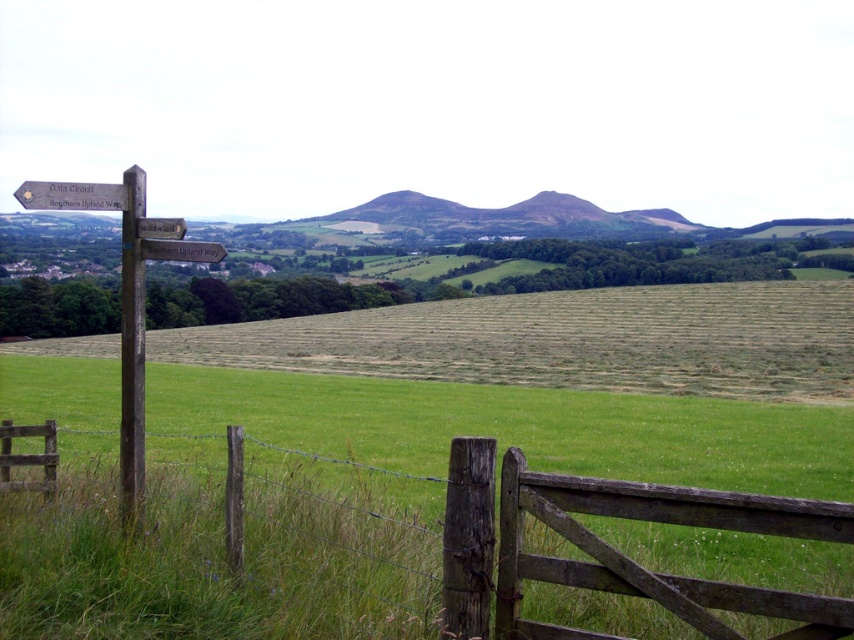
Can you confirm if wooden gate at lower center is taller than wooden signpost at left?

Incorrect, wooden gate at lower center's height is not larger of wooden signpost at left's.

Who is taller, wooden gate at lower center or wooden signpost at left?

wooden signpost at left is taller.

Who is more distant from viewer, [284,508] or [127,230]?

The point [284,508] is more distant.

What are the coordinates of `wooden gate at lower center` in the screenshot? It's located at pyautogui.click(x=393, y=557).

Is point (120, 317) farther from viewer compared to point (126, 316)?

Yes, it is behind point (126, 316).

Which is in front, point (138, 356) or point (124, 390)?

Point (124, 390) is more forward.

Locate an element on the screen. This screenshot has width=854, height=640. wooden signpost at left is located at coordinates (127, 298).

Is wooden gate at lower center to the left of brown wooden post at left from the viewer's perspective?

Incorrect, wooden gate at lower center is not on the left side of brown wooden post at left.

Can you confirm if wooden gate at lower center is wider than brown wooden post at left?

Yes, wooden gate at lower center is wider than brown wooden post at left.

Between point (481, 609) and point (127, 364), which one is positioned behind?

The point (127, 364) is behind.

Locate an element on the screen. wooden gate at lower center is located at coordinates (393, 557).